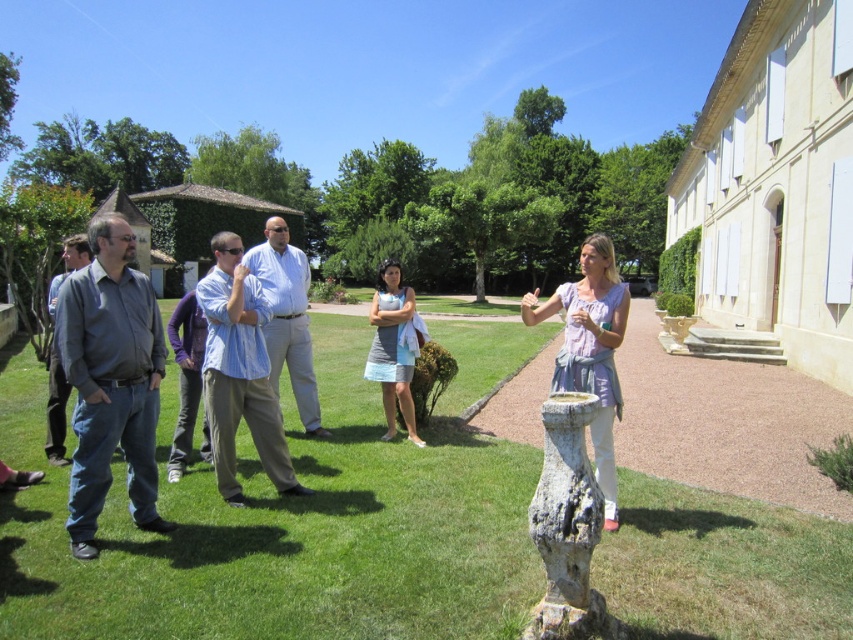
You are a photographer trying to capture a group photo of the dark gray shirt at center and the light blue shirt at center. Which person should you focus on first if you want to ensure both are in frame without moving the camera?

You should focus on the dark gray shirt at center first because it is smaller than the light blue shirt at center, so positioning the camera to include the smaller one ensures the larger one will also fit.

You are standing in the garden and want to take a photo of the stone fountain at center. Your camera has a minimum focusing distance of 3 meters. Can you take a clear photo without moving closer?

The stone fountain at center is 3.10 meters away from the viewer. Since the minimum focusing distance is 3 meters, the camera can focus and take a clear photo as the distance is within range.